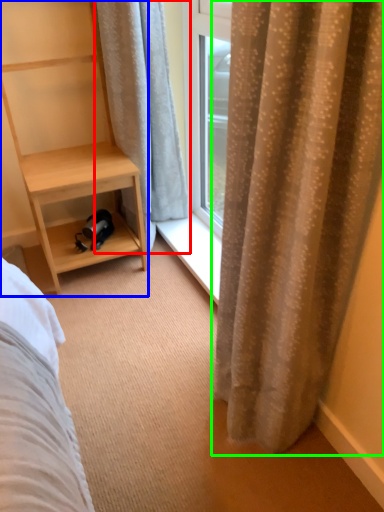
Question: Based on their relative distances, which object is nearer to curtain (highlighted by a red box)? Choose from shelf (highlighted by a blue box) and curtain (highlighted by a green box).

Choices:
 (A) shelf
 (B) curtain

Answer: (A)